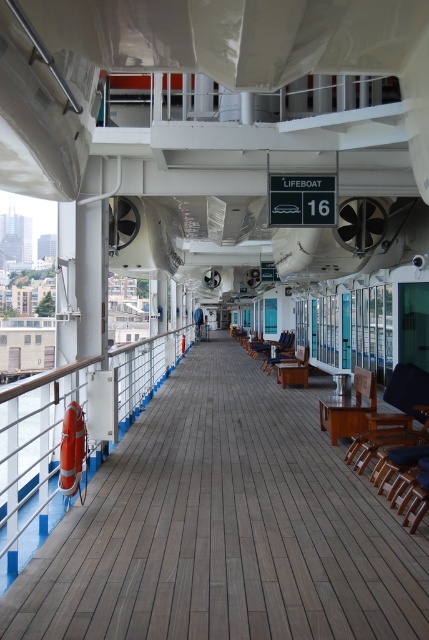
From the picture: Does wooden at center have a smaller size compared to orange rubber lifebuoy at left?

Indeed, wooden at center has a smaller size compared to orange rubber lifebuoy at left.

Can you confirm if wooden at center is positioned to the right of orange rubber lifebuoy at left?

Yes, wooden at center is to the right of orange rubber lifebuoy at left.

Is point (208, 362) positioned in front of point (0, 392)?

No, it is not.

At what (x,y) coordinates should I click in order to perform the action: click on wooden at center. Please return your answer as a coordinate pair (x, y). The image size is (429, 640). Looking at the image, I should click on (224, 528).